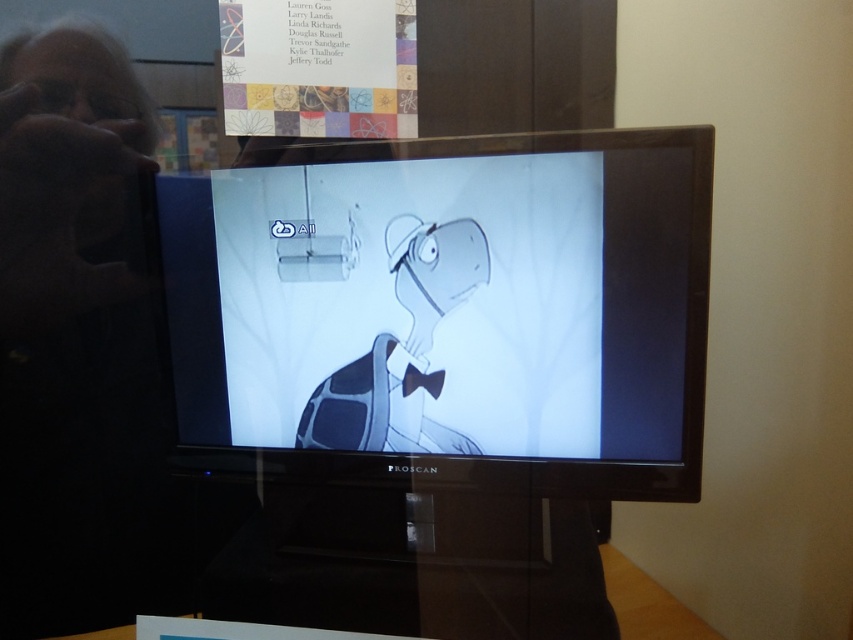
You are a TV repair technician inspecting the PROSCAN television. You notice the matte black screen at center and the gray matte turtle at center. Which object is closer to you?

The matte black screen at center is closer to you since it is in front of the gray matte turtle at center.

In the scene shown: You are a TV repair technician who needs to adjust the positioning of the matte black screen at center and the gray matte turtle at center. Which object is located higher in the image?

The matte black screen at center is positioned over the gray matte turtle at center, meaning it is higher up in the image.

You are holding a remote control that is 3 inches long. You want to press a button located on the matte black screen at center. Can you reach the button from the gray matte turtle at center without moving the turtle or the screen?

The distance between the matte black screen at center and the gray matte turtle at center is 2.81 inches, which is less than the 3 inches length of the remote control. Therefore, you can reach the button on the matte black screen at center from the gray matte turtle at center using the remote control.